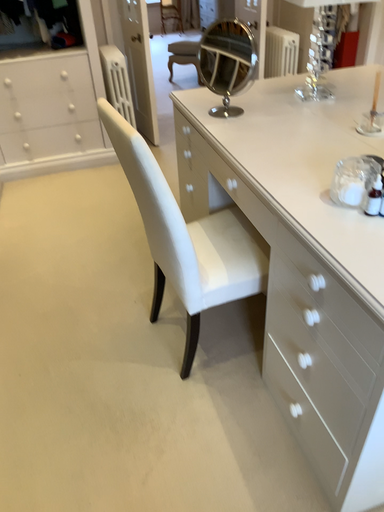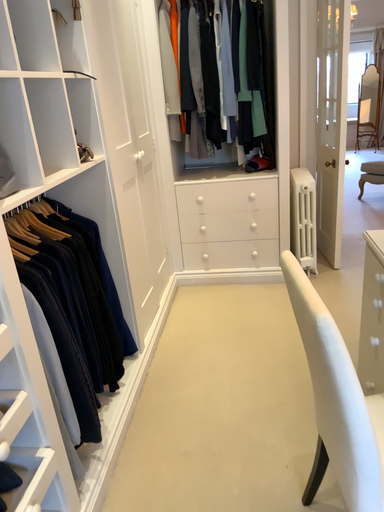
Question: How did the camera likely rotate when shooting the video?

Choices:
 (A) rotated downward
 (B) rotated upward

Answer: (B)